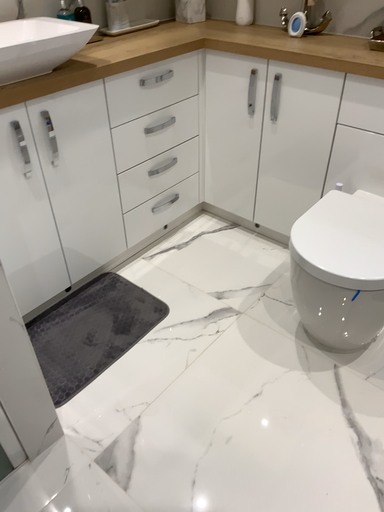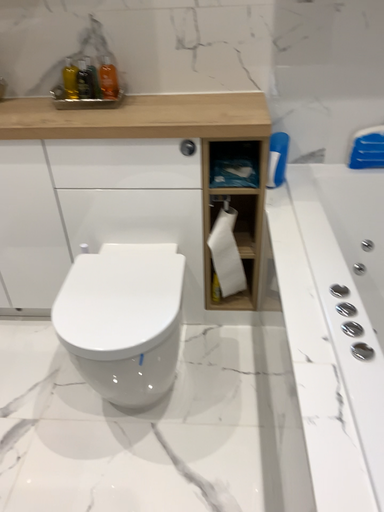
Question: How did the camera likely rotate when shooting the video?

Choices:
 (A) rotated right
 (B) rotated left

Answer: (A)